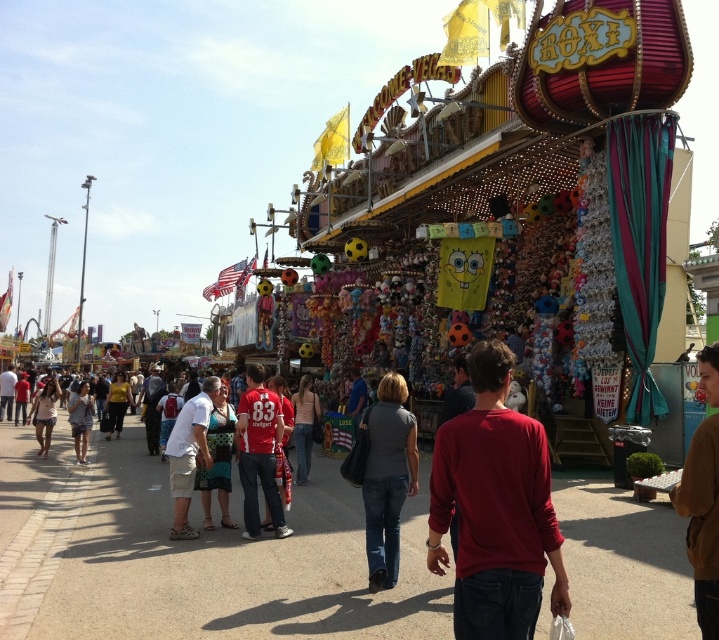
The image size is (719, 640). What do you see at coordinates (260, 452) in the screenshot? I see `matte red jersey at center` at bounding box center [260, 452].

Which is above, matte red jersey at center or white cotton shirt at center?

→ matte red jersey at center is above.

Which is in front, point (275, 531) or point (186, 406)?

Point (275, 531) is in front.

Where is `matte red jersey at center`? This screenshot has height=640, width=719. matte red jersey at center is located at coordinates (260, 452).

Which of these two, red cotton shirt at center or gray matte shirt at center, stands taller?

With more height is red cotton shirt at center.

Does point (540, 483) lie in front of point (403, 490)?

Yes, point (540, 483) is closer to viewer.

Where is `red cotton shirt at center`? red cotton shirt at center is located at coordinates (494, 508).

This screenshot has height=640, width=719. In order to click on red cotton shirt at center in this screenshot , I will do `click(494, 508)`.

The width and height of the screenshot is (719, 640). In order to click on gray matte shirt at center in this screenshot , I will do `click(388, 477)`.

In the scene shown: Can you confirm if gray matte shirt at center is positioned to the left of white cotton shirt at center?

Incorrect, gray matte shirt at center is not on the left side of white cotton shirt at center.

Is point (367, 474) less distant than point (188, 403)?

Yes, it is.

The width and height of the screenshot is (719, 640). I want to click on gray matte shirt at center, so click(x=388, y=477).